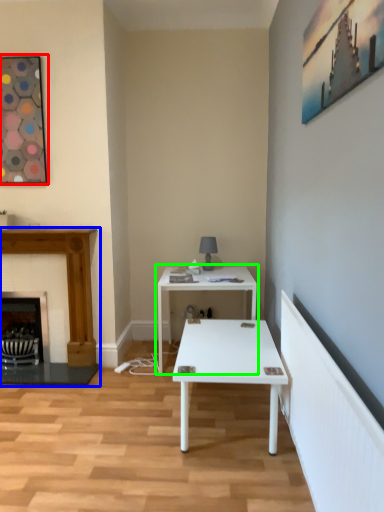
Question: Based on their relative distances, which object is farther from picture frame (highlighted by a red box)? Choose from fireplace (highlighted by a blue box) and table (highlighted by a green box).

Choices:
 (A) fireplace
 (B) table

Answer: (B)